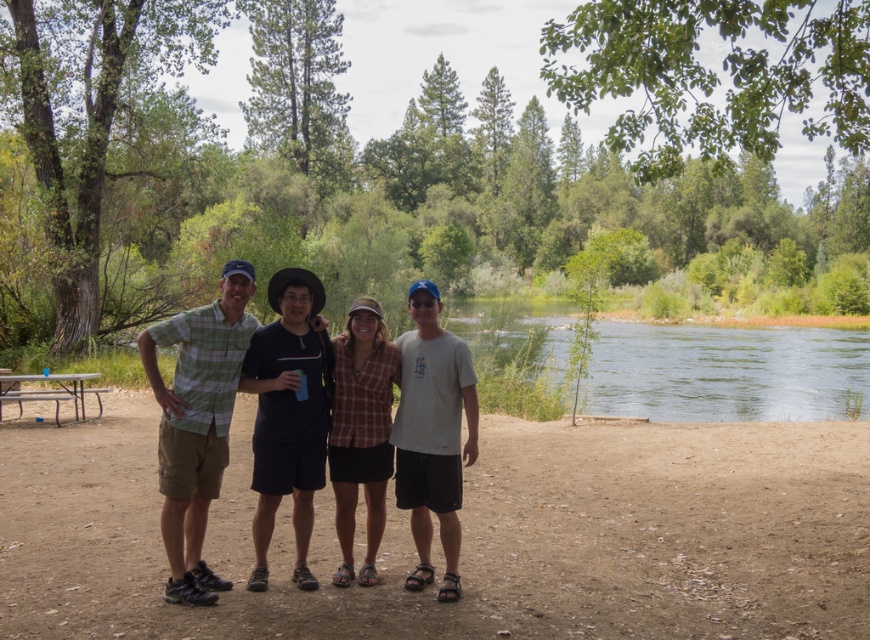
Which is more to the right, green plaid shirt at center or metallic silver picnic table at lower left?

Positioned to the right is green plaid shirt at center.

Where is `green plaid shirt at center`? green plaid shirt at center is located at coordinates (197, 422).

The height and width of the screenshot is (640, 870). Find the location of `green plaid shirt at center`. green plaid shirt at center is located at coordinates (197, 422).

Between white cotton t-shirt at center and metallic silver picnic table at lower left, which one appears on the right side from the viewer's perspective?

white cotton t-shirt at center

Is point (423, 284) closer to camera compared to point (5, 387)?

Yes.

The width and height of the screenshot is (870, 640). In order to click on white cotton t-shirt at center in this screenshot , I will do `click(432, 435)`.

I want to click on green plaid shirt at center, so click(197, 422).

Who is more forward, (231, 406) or (456, 340)?

Point (231, 406) is more forward.

Is point (193, 440) positioned before point (467, 378)?

Yes, point (193, 440) is in front of point (467, 378).

At what (x,y) coordinates should I click in order to perform the action: click on green plaid shirt at center. Please return your answer as a coordinate pair (x, y). The height and width of the screenshot is (640, 870). Looking at the image, I should click on (197, 422).